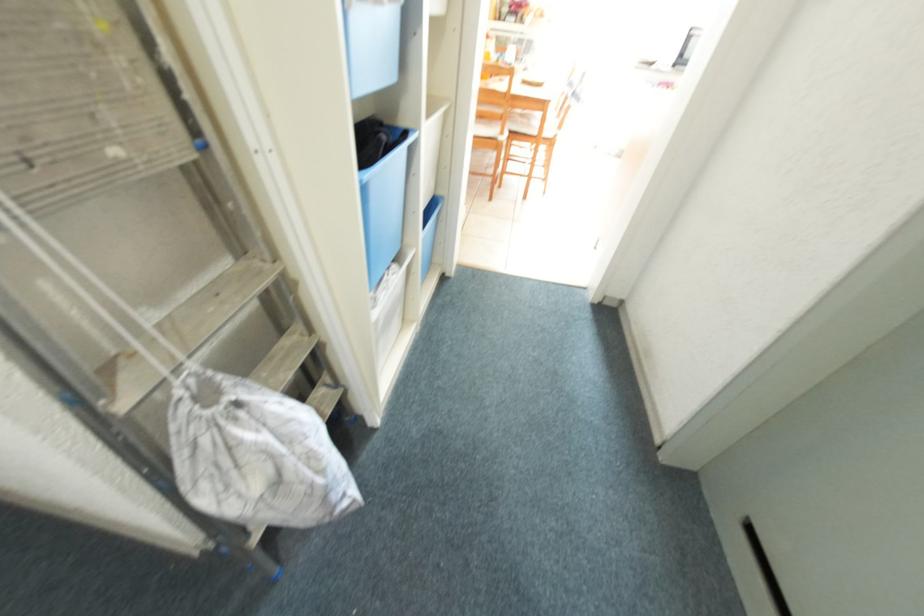
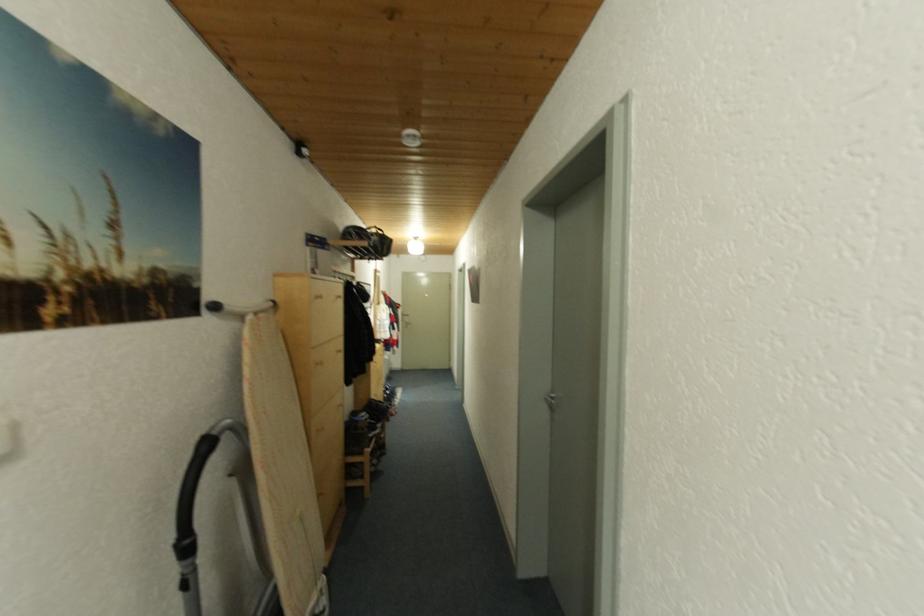
Question: Based on the continuous images, in which direction is the camera rotating? Reply with the corresponding letter.

Choices:
 (A) Left
 (B) Right
 (C) Up
 (D) Down

Answer: (A)